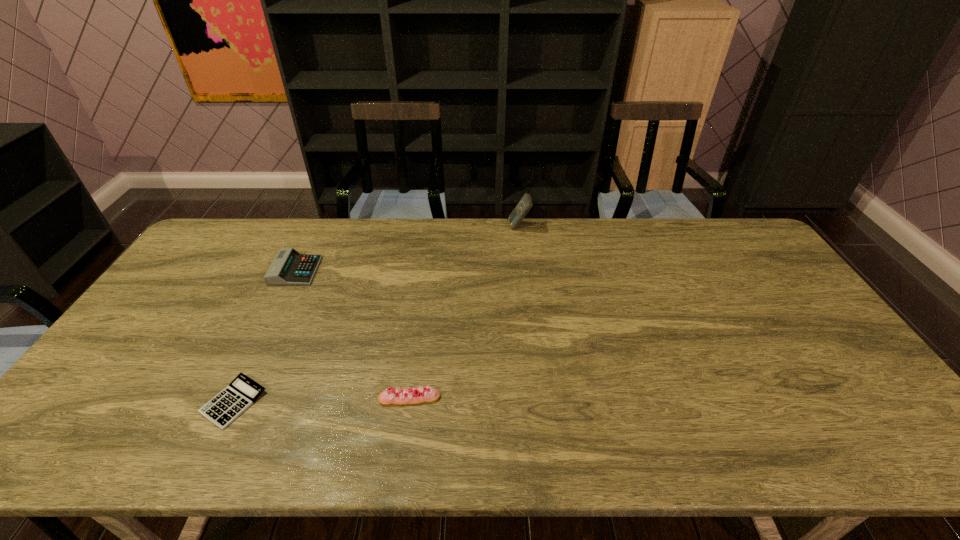
The image size is (960, 540). I want to click on free space between the second tallest calculator and the second object from right to left, so click(352, 334).

Locate an element on the screen. Image resolution: width=960 pixels, height=540 pixels. vacant point located between the rightmost object and the shortest calculator is located at coordinates (376, 314).

This screenshot has height=540, width=960. What are the coordinates of `free space between the second object from right to left and the rightmost object` in the screenshot? It's located at (465, 312).

The width and height of the screenshot is (960, 540). I want to click on vacant region between the tallest calculator and the shortest object, so click(x=376, y=314).

At what (x,y) coordinates should I click in order to perform the action: click on free space that is in between the tallest object and the shortest object. Please return your answer as a coordinate pair (x, y). The image size is (960, 540). Looking at the image, I should click on (376, 314).

This screenshot has height=540, width=960. Find the location of `free space between the nearest calculator and the rightmost calculator`. free space between the nearest calculator and the rightmost calculator is located at coordinates (376, 314).

Find the location of `free space between the tallest calculator and the second farthest object`. free space between the tallest calculator and the second farthest object is located at coordinates (408, 249).

Image resolution: width=960 pixels, height=540 pixels. I want to click on blank region between the second tallest calculator and the tallest object, so click(x=408, y=249).

Where is `free space between the shortest calculator and the farthest calculator`? free space between the shortest calculator and the farthest calculator is located at coordinates (376, 314).

Select which object is the third closest to the shortest calculator. Please provide its 2D coordinates. Your answer should be formatted as a tuple, i.e. [(x, y)], where the tuple contains the x and y coordinates of a point satisfying the conditions above.

[(525, 204)]